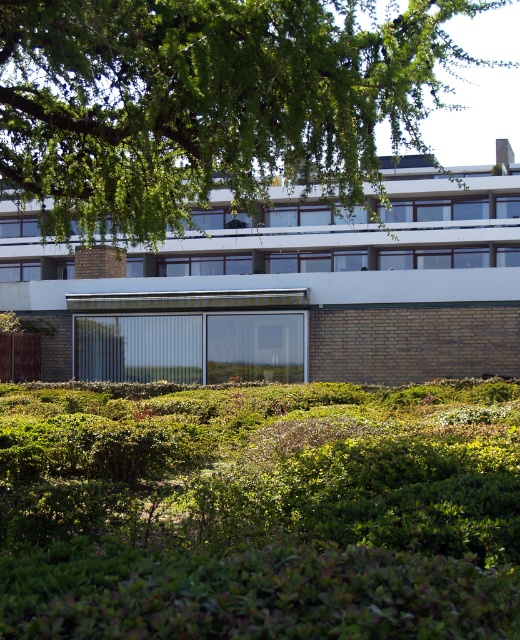
Question: Does green leafy hedge at lower center lie in front of green leafy tree at upper center?

Choices:
 (A) yes
 (B) no

Answer: (A)

Question: Considering the relative positions of green leafy hedge at lower center and green leafy tree at upper center in the image provided, where is green leafy hedge at lower center located with respect to green leafy tree at upper center?

Choices:
 (A) above
 (B) below

Answer: (B)

Question: Does green leafy hedge at lower center appear over green leafy tree at upper center?

Choices:
 (A) yes
 (B) no

Answer: (B)